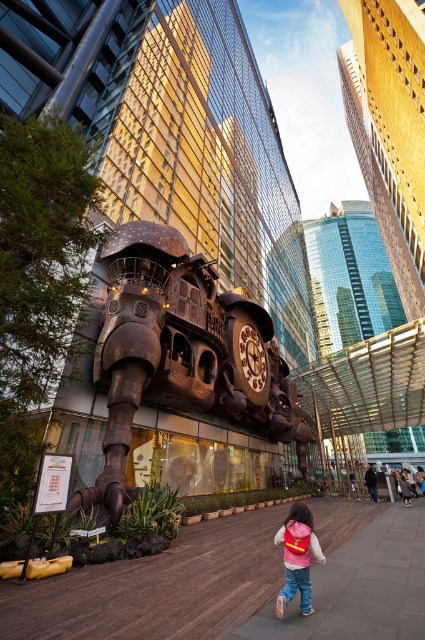
Question: Can you confirm if shiny bronze clock at center is positioned to the left of pink fabric backpack at lower right?

Choices:
 (A) no
 (B) yes

Answer: (B)

Question: Among these objects, which one is farthest from the camera?

Choices:
 (A) shiny bronze clock at center
 (B) pink fabric backpack at lower right

Answer: (A)

Question: Is shiny bronze clock at center positioned at the back of pink fabric backpack at lower right?

Choices:
 (A) no
 (B) yes

Answer: (B)

Question: Which point is closer to the camera taking this photo?

Choices:
 (A) (308, 573)
 (B) (144, 356)

Answer: (A)

Question: Among these points, which one is nearest to the camera?

Choices:
 (A) (306, 609)
 (B) (141, 259)

Answer: (A)

Question: Is shiny bronze clock at center thinner than pink fabric backpack at lower right?

Choices:
 (A) yes
 (B) no

Answer: (B)